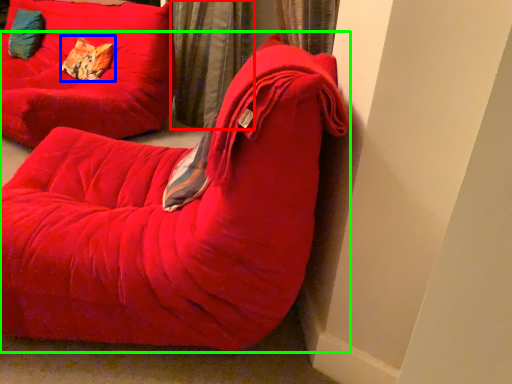
Question: Estimate the real-world distances between objects in this image. Which object is farther from curtain (highlighted by a red box), pillow (highlighted by a blue box) or furniture (highlighted by a green box)?

Choices:
 (A) pillow
 (B) furniture

Answer: (B)